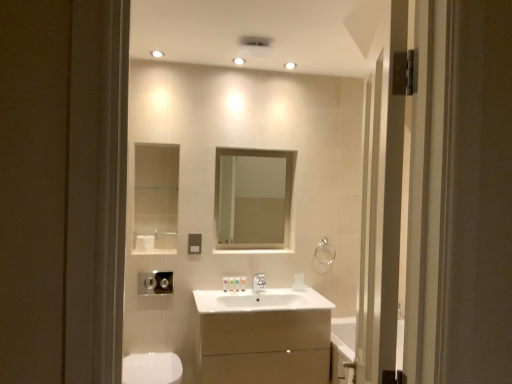
Image resolution: width=512 pixels, height=384 pixels. Identify the location of vacant area to the right of silver metallic faucet at center. 282,292.